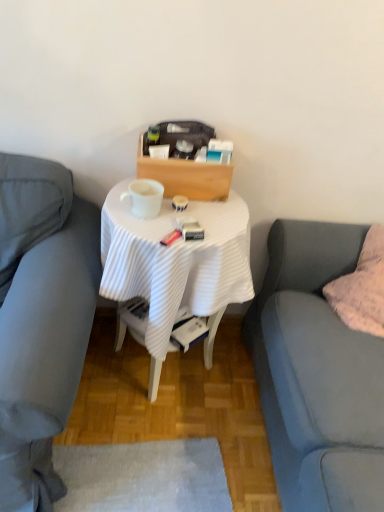
This screenshot has width=384, height=512. Identify the location of vacant space to the right of white glossy mug at center. (206, 216).